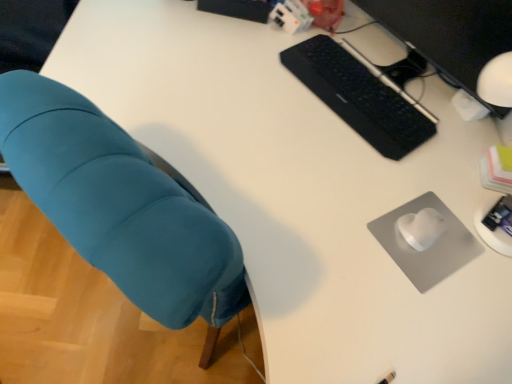
Identify the location of vacant space to the left of black matte computer monitor at upper right. The image size is (512, 384). (275, 67).